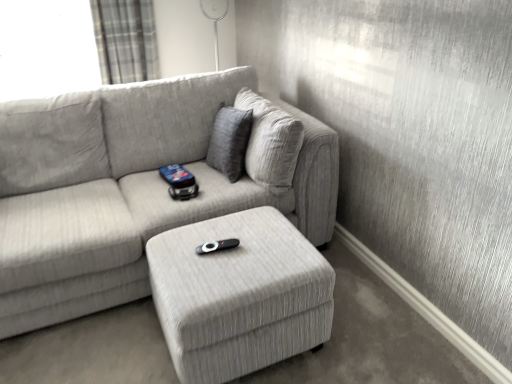
In order to face textured gray ottoman at center, should I rotate leftwards or rightwards?

Turn left approximately 2.963 degrees to face it.

Find the location of a particular element. light gray fabric couch at center is located at coordinates (138, 186).

Describe the element at coordinates (125, 40) in the screenshot. I see `plaid fabric curtain at upper left` at that location.

Find the location of a particular element. The height and width of the screenshot is (384, 512). textured gray ottoman at center is located at coordinates (239, 295).

Is plaid fabric curtain at upper left not inside light gray fabric couch at center?

Yes.

Is plaid fabric curtain at upper left smaller than light gray fabric couch at center?

Yes.

Considering the positions of points (104, 62) and (63, 290), is point (104, 62) closer to camera compared to point (63, 290)?

No.

From a real-world perspective, is plaid fabric curtain at upper left on top of light gray fabric couch at center?

Yes, from a real-world perspective, plaid fabric curtain at upper left is on top of light gray fabric couch at center.

From a real-world perspective, is plaid fabric curtain at upper left over black plastic remote at center?

Yes, from a real-world perspective, plaid fabric curtain at upper left is above black plastic remote at center.

Which is less distant, [112,19] or [224,239]?

The point [224,239] is closer to the camera.

From the image's perspective, is plaid fabric curtain at upper left beneath black plastic remote at center?

No.

Would you say plaid fabric curtain at upper left is a long distance from black plastic remote at center?

Yes, plaid fabric curtain at upper left is far from black plastic remote at center.

Considering the sizes of objects black plastic remote at center and textured gray ottoman at center in the image provided, who is smaller, black plastic remote at center or textured gray ottoman at center?

Smaller between the two is black plastic remote at center.

From the image's perspective, relative to textured gray ottoman at center, is black plastic remote at center above or below?

From the image's perspective, black plastic remote at center appears above textured gray ottoman at center.

Who is more distant, black plastic remote at center or textured gray ottoman at center?

Positioned behind is black plastic remote at center.

Is the surface of black plastic remote at center in direct contact with textured gray ottoman at center?

They are not placed beside each other.

Considering the relative sizes of textured gray ottoman at center and light gray fabric couch at center in the image provided, is textured gray ottoman at center taller than light gray fabric couch at center?

No.

Is the surface of textured gray ottoman at center in direct contact with light gray fabric couch at center?

No, textured gray ottoman at center is not next to light gray fabric couch at center.

Would you say textured gray ottoman at center is inside or outside light gray fabric couch at center?

textured gray ottoman at center is not inside light gray fabric couch at center, it's outside.

Considering the relative positions of light gray fabric couch at center and textured gray ottoman at center in the image provided, is light gray fabric couch at center to the left or to the right of textured gray ottoman at center?

Clearly, light gray fabric couch at center is on the left of textured gray ottoman at center in the image.

Between light gray fabric couch at center and textured gray ottoman at center, which one has larger width?

Wider between the two is light gray fabric couch at center.

Based on the photo, considering the sizes of objects light gray fabric couch at center and textured gray ottoman at center in the image provided, who is taller, light gray fabric couch at center or textured gray ottoman at center?

light gray fabric couch at center is taller.

From a real-world perspective, which is physically above, light gray fabric couch at center or textured gray ottoman at center?

light gray fabric couch at center.

Could you tell me if plaid fabric curtain at upper left is facing textured gray ottoman at center?

Yes, plaid fabric curtain at upper left is facing textured gray ottoman at center.

Who is bigger, plaid fabric curtain at upper left or textured gray ottoman at center?

Bigger between the two is textured gray ottoman at center.

From their relative heights in the image, would you say plaid fabric curtain at upper left is taller or shorter than textured gray ottoman at center?

Clearly, plaid fabric curtain at upper left is taller compared to textured gray ottoman at center.

Which object is positioned more to the right, light gray fabric couch at center or black plastic remote at center?

From the viewer's perspective, black plastic remote at center appears more on the right side.

From the image's perspective, between light gray fabric couch at center and black plastic remote at center, who is located below?

black plastic remote at center, from the image's perspective.

Is light gray fabric couch at center inside or outside of black plastic remote at center?

light gray fabric couch at center lies outside black plastic remote at center.

Between light gray fabric couch at center and black plastic remote at center, which one has larger width?

Wider between the two is light gray fabric couch at center.

At what (x,y) coordinates should I click in order to perform the action: click on studio couch located on the right of plaid fabric curtain at upper left. Please return your answer as a coordinate pair (x, y). The image size is (512, 384). Looking at the image, I should click on (138, 186).

In order to click on curtain above the black plastic remote at center (from the image's perspective) in this screenshot , I will do `click(125, 40)`.

Based on their spatial positions, is textured gray ottoman at center or black plastic remote at center further from light gray fabric couch at center?

black plastic remote at center lies further to light gray fabric couch at center than the other object.

Looking at this image, looking at the image, which one is located further to plaid fabric curtain at upper left, light gray fabric couch at center or textured gray ottoman at center?

textured gray ottoman at center is further to plaid fabric curtain at upper left.

Looking at the image, which one is located further to plaid fabric curtain at upper left, black plastic remote at center or light gray fabric couch at center?

The object further to plaid fabric curtain at upper left is black plastic remote at center.

Considering their positions, is textured gray ottoman at center positioned closer to light gray fabric couch at center than plaid fabric curtain at upper left?

textured gray ottoman at center.

Which object lies nearer to the anchor point light gray fabric couch at center, plaid fabric curtain at upper left or textured gray ottoman at center?

textured gray ottoman at center is closer to light gray fabric couch at center.

Looking at the image, which one is located further to textured gray ottoman at center, light gray fabric couch at center or plaid fabric curtain at upper left?

The object further to textured gray ottoman at center is plaid fabric curtain at upper left.

Considering their positions, is plaid fabric curtain at upper left positioned closer to textured gray ottoman at center than light gray fabric couch at center?

Based on the image, light gray fabric couch at center appears to be nearer to textured gray ottoman at center.

Looking at the image, which one is located closer to plaid fabric curtain at upper left, textured gray ottoman at center or light gray fabric couch at center?

light gray fabric couch at center is positioned closer to the anchor plaid fabric curtain at upper left.

The height and width of the screenshot is (384, 512). In order to click on table positioned between light gray fabric couch at center and plaid fabric curtain at upper left from near to far in this screenshot , I will do `click(239, 295)`.

At what (x,y) coordinates should I click in order to perform the action: click on remote between plaid fabric curtain at upper left and textured gray ottoman at center in the vertical direction. Please return your answer as a coordinate pair (x, y). This screenshot has height=384, width=512. Looking at the image, I should click on (217, 246).

Identify the location of remote positioned between light gray fabric couch at center and plaid fabric curtain at upper left from near to far. This screenshot has height=384, width=512. (217, 246).

At what (x,y) coordinates should I click in order to perform the action: click on remote between light gray fabric couch at center and textured gray ottoman at center in the up-down direction. Please return your answer as a coordinate pair (x, y). The height and width of the screenshot is (384, 512). Looking at the image, I should click on (217, 246).